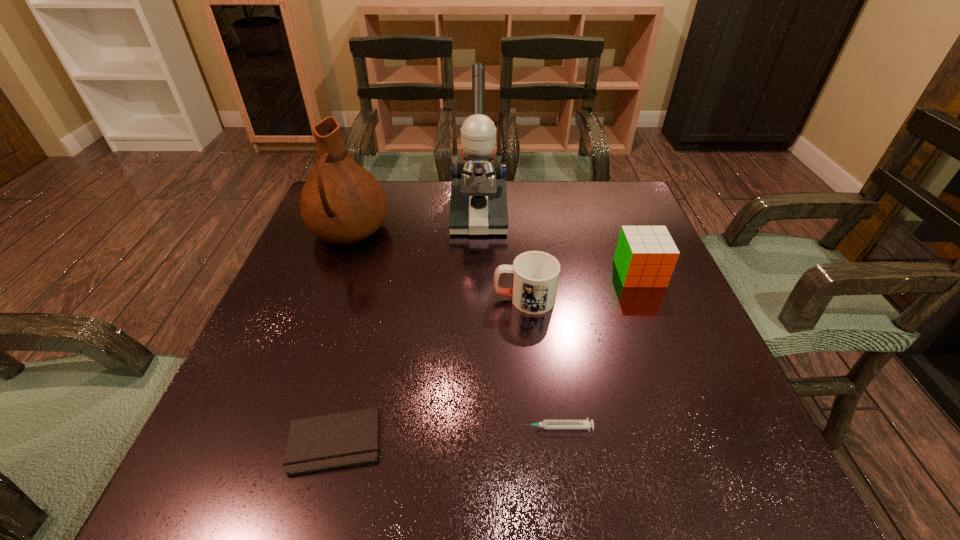
This screenshot has height=540, width=960. Identify the location of checkbook that is at the left edge. (337, 440).

The width and height of the screenshot is (960, 540). I want to click on object located at the right edge, so click(x=645, y=256).

Identify the location of object present at the far left corner. This screenshot has width=960, height=540. (341, 202).

The image size is (960, 540). What are the coordinates of `object that is at the near left corner` in the screenshot? It's located at (337, 440).

The height and width of the screenshot is (540, 960). In the image, there is a desktop. Identify the location of free space at the far edge. (411, 199).

Where is `blank space at the near edge of the desktop`? Image resolution: width=960 pixels, height=540 pixels. blank space at the near edge of the desktop is located at coordinates point(341,469).

Where is `vacant space at the left edge of the desktop`? vacant space at the left edge of the desktop is located at coordinates (293, 288).

In the image, there is a desktop. Where is `vacant space at the right edge`? The height and width of the screenshot is (540, 960). vacant space at the right edge is located at coordinates (604, 250).

Find the location of a particular element. The height and width of the screenshot is (540, 960). vacant space at the far right corner of the desktop is located at coordinates (579, 190).

At what (x,y) coordinates should I click in order to perform the action: click on free space between the shortest object and the rightmost object. Please return your answer as a coordinate pair (x, y). The height and width of the screenshot is (540, 960). Looking at the image, I should click on (487, 357).